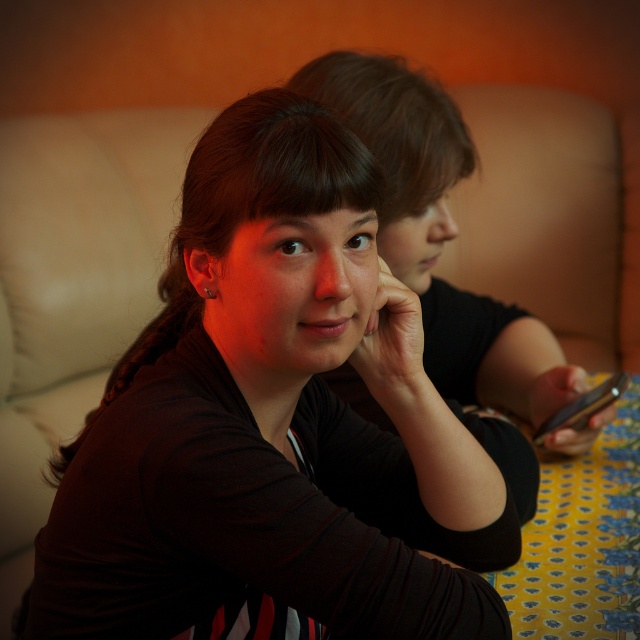
Question: Which point is closer to the camera?

Choices:
 (A) (376, 288)
 (B) (595, 404)

Answer: (A)

Question: Which point is farther from the camera taking this photo?

Choices:
 (A) (515, 516)
 (B) (577, 422)

Answer: (B)

Question: Observing the image, what is the correct spatial positioning of matte black shirt at center in reference to black glossy smartphone at right?

Choices:
 (A) left
 (B) right

Answer: (A)

Question: Can you confirm if matte black shirt at center is bigger than black glossy smartphone at right?

Choices:
 (A) yes
 (B) no

Answer: (A)

Question: Can you confirm if matte black shirt at center is positioned to the left of black glossy smartphone at right?

Choices:
 (A) no
 (B) yes

Answer: (B)

Question: Among these objects, which one is nearest to the camera?

Choices:
 (A) black glossy smartphone at right
 (B) matte black shirt at center

Answer: (B)